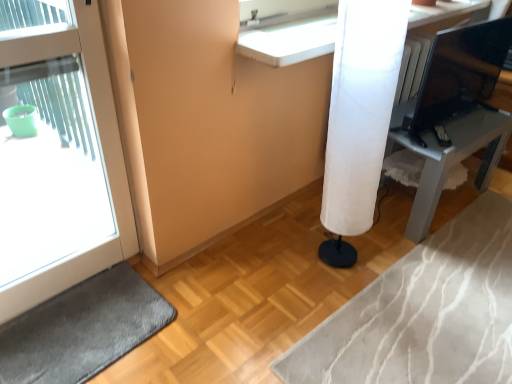
Question: From their relative heights in the image, would you say white fabric lamp at right is taller or shorter than matte black monitor at upper right?

Choices:
 (A) short
 (B) tall

Answer: (B)

Question: Considering the relative positions of white fabric lamp at right and matte black monitor at upper right in the image provided, is white fabric lamp at right to the left or to the right of matte black monitor at upper right?

Choices:
 (A) right
 (B) left

Answer: (B)

Question: Which object is the farthest from the white glossy counter at upper center?

Choices:
 (A) dark gray carpet at lower left
 (B) matte black monitor at upper right
 (C) white fabric lamp at right
 (D) white glossy door at left
 (E) white fabric lampshade at center-right

Answer: (A)

Question: Estimate the real-world distances between objects in this image. Which object is farther from the matte black monitor at upper right?

Choices:
 (A) white fabric lamp at right
 (B) white glossy counter at upper center
 (C) white fabric lampshade at center-right
 (D) dark gray carpet at lower left
 (E) white glossy door at left

Answer: (D)